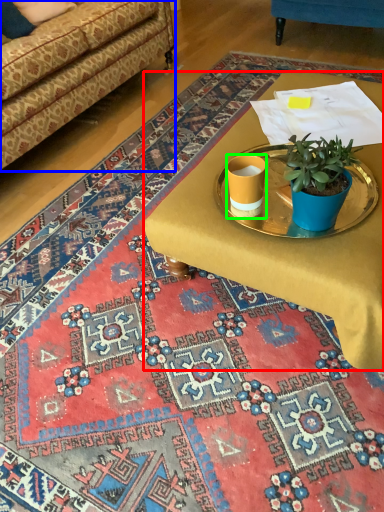
Question: Which object is positioned closest to desk (highlighted by a red box)? Select from studio couch (highlighted by a blue box) and coffee cup (highlighted by a green box).

Choices:
 (A) studio couch
 (B) coffee cup

Answer: (B)